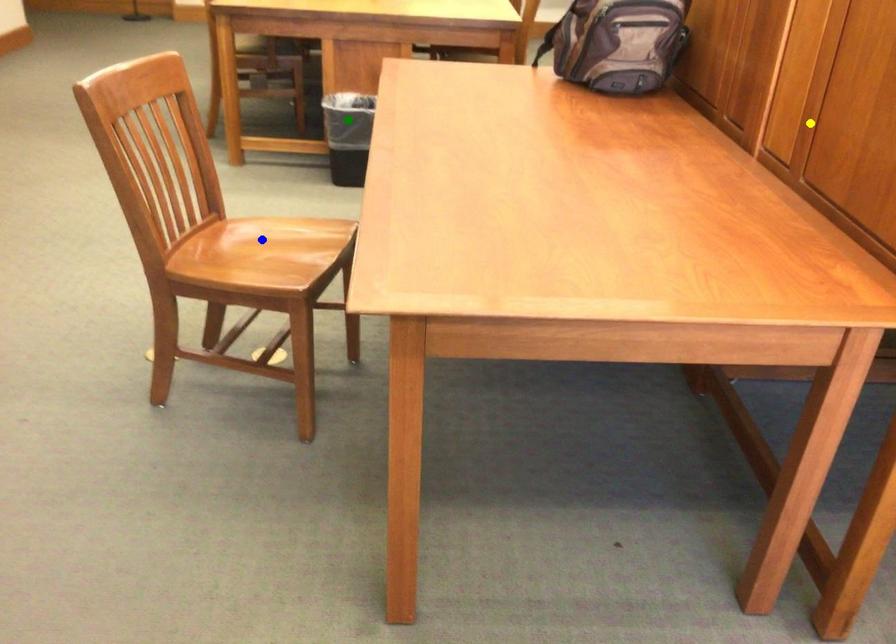
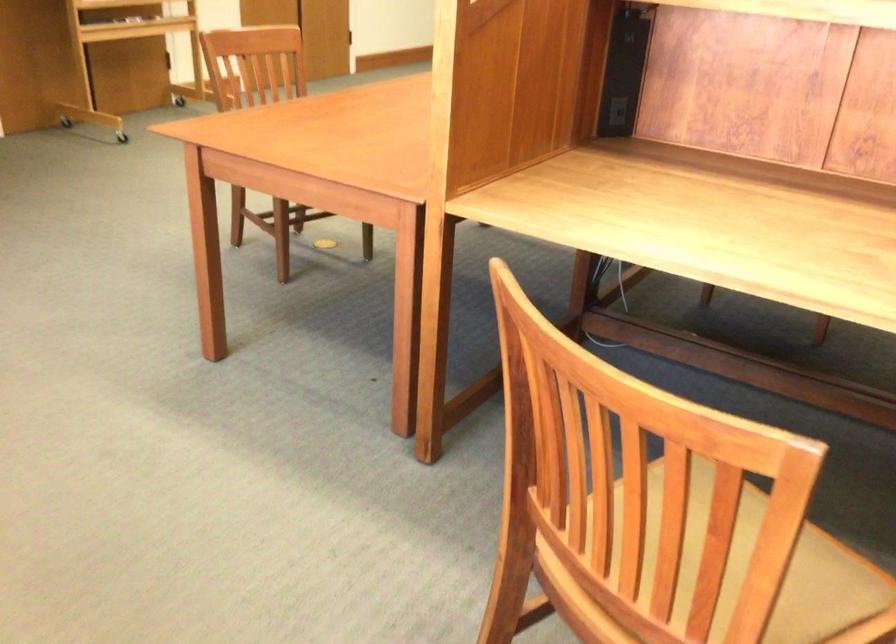
I am providing you with two images of the same scene from different viewpoints. Three points are marked in image1. Which point corresponds to a part or object that is occluded in image2?In image1, three points are marked. Which of them correspond to a part or object that is occluded in image2?Among the three points shown in image1, which one corresponds to a part or object that is no longer visible due to occlusion in image2?

Invisible in image2: blue point, green point.